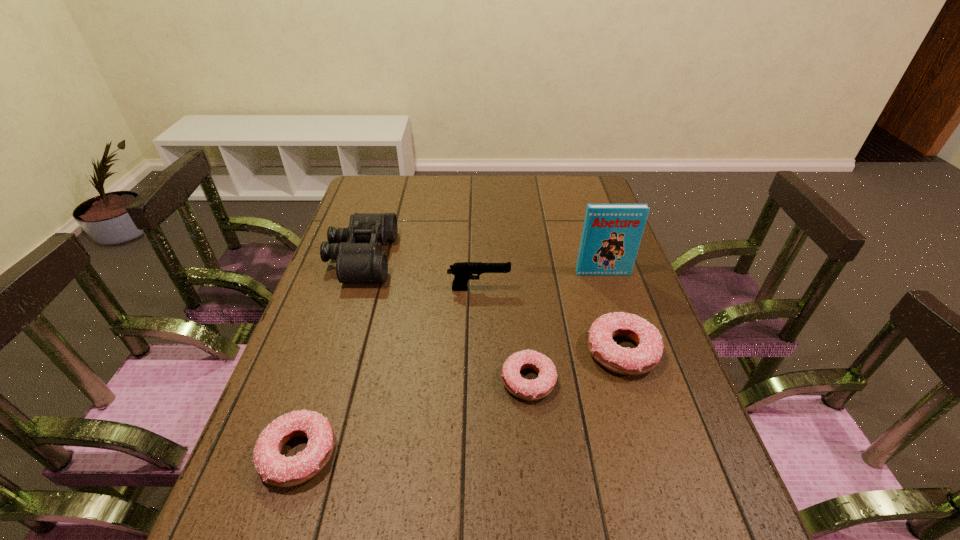
Where is `vacant space at the far edge`? The width and height of the screenshot is (960, 540). vacant space at the far edge is located at coordinates (485, 178).

Locate an element on the screen. The image size is (960, 540). free region at the near edge is located at coordinates (560, 496).

Identify the location of vacant space at the left edge of the desktop. This screenshot has width=960, height=540. [327, 362].

The width and height of the screenshot is (960, 540). I want to click on free spot at the right edge of the desktop, so click(602, 276).

This screenshot has height=540, width=960. In the image, there is a desktop. What are the coordinates of `vacant space at the near right corner` in the screenshot? It's located at (712, 481).

Locate an element on the screen. The width and height of the screenshot is (960, 540). unoccupied area between the third tallest object and the nearest doughnut is located at coordinates (389, 372).

Locate an element on the screen. The image size is (960, 540). empty space that is in between the tallest object and the rightmost doughnut is located at coordinates (612, 313).

The image size is (960, 540). What are the coordinates of `free space between the third tallest object and the second shortest object` in the screenshot? It's located at (389, 372).

At what (x,y) coordinates should I click in order to perform the action: click on vacant space that's between the binoculars and the nearest doughnut. Please return your answer as a coordinate pair (x, y). Image resolution: width=960 pixels, height=540 pixels. Looking at the image, I should click on (330, 356).

Locate an element on the screen. vacant space in between the tallest object and the rightmost doughnut is located at coordinates (612, 313).